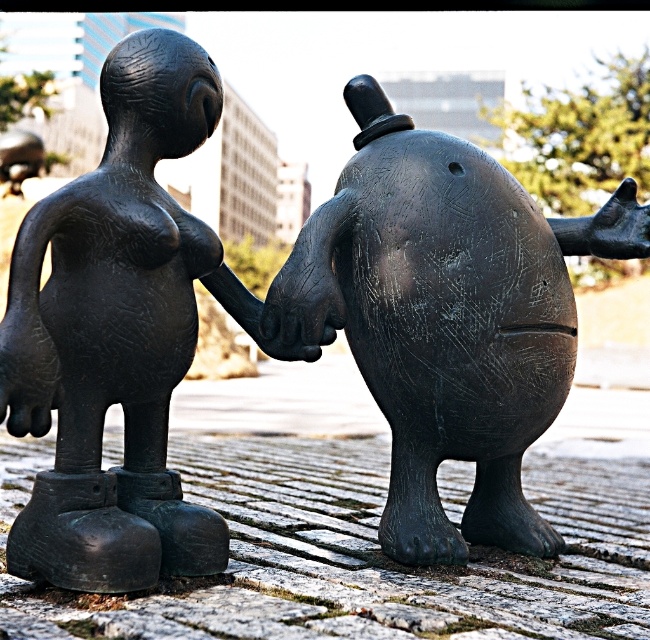
Can you confirm if matte black sculpture at center is positioned to the right of matte black statue at center?

Correct, you'll find matte black sculpture at center to the right of matte black statue at center.

Is matte black sculpture at center thinner than matte black statue at center?

No.

Which is behind, point (452, 216) or point (60, 300)?

The point (452, 216) is behind.

Find the location of `matte black sculpture at center`. matte black sculpture at center is located at coordinates (447, 317).